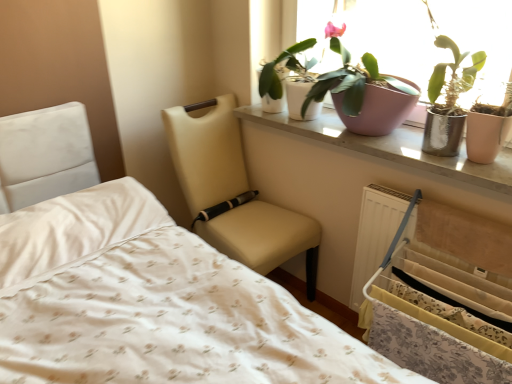
Question: Can you confirm if pink ceramic window sill at upper center is taller than beige leather chair at center?

Choices:
 (A) no
 (B) yes

Answer: (A)

Question: Is pink ceramic window sill at upper center far away from beige leather chair at center?

Choices:
 (A) yes
 (B) no

Answer: (B)

Question: Considering the relative sizes of pink ceramic window sill at upper center and beige leather chair at center in the image provided, is pink ceramic window sill at upper center wider than beige leather chair at center?

Choices:
 (A) yes
 (B) no

Answer: (B)

Question: Is pink ceramic window sill at upper center to the right of beige leather chair at center from the viewer's perspective?

Choices:
 (A) no
 (B) yes

Answer: (B)

Question: From a real-world perspective, is pink ceramic window sill at upper center over beige leather chair at center?

Choices:
 (A) yes
 (B) no

Answer: (A)

Question: Does pink ceramic window sill at upper center have a lesser height compared to beige leather chair at center?

Choices:
 (A) yes
 (B) no

Answer: (A)

Question: From a real-world perspective, is white glossy pot at upper center, the second houseplant viewed from the right, located higher than pink matte pot at upper center, marked as the 2th houseplant in a left-to-right arrangement?

Choices:
 (A) yes
 (B) no

Answer: (B)

Question: Does white glossy pot at upper center, the second houseplant viewed from the right, come in front of pink matte pot at upper center, marked as the 2th houseplant in a left-to-right arrangement?

Choices:
 (A) no
 (B) yes

Answer: (A)

Question: Is white glossy pot at upper center, the second houseplant viewed from the right, wider than pink matte pot at upper center, the first houseplant from the right?

Choices:
 (A) no
 (B) yes

Answer: (A)

Question: Does white glossy pot at upper center, the second houseplant viewed from the right, have a smaller size compared to pink matte pot at upper center, marked as the 2th houseplant in a left-to-right arrangement?

Choices:
 (A) no
 (B) yes

Answer: (B)

Question: Is white glossy pot at upper center, marked as the first houseplant in a left-to-right arrangement, bigger than pink matte pot at upper center, the first houseplant from the right?

Choices:
 (A) yes
 (B) no

Answer: (B)

Question: Is white glossy pot at upper center, marked as the first houseplant in a left-to-right arrangement, facing towards pink matte pot at upper center, marked as the 2th houseplant in a left-to-right arrangement?

Choices:
 (A) no
 (B) yes

Answer: (A)

Question: Does pink matte pot at upper center, the first houseplant from the right, have a greater height compared to white fabric bed frame at lower right?

Choices:
 (A) yes
 (B) no

Answer: (B)